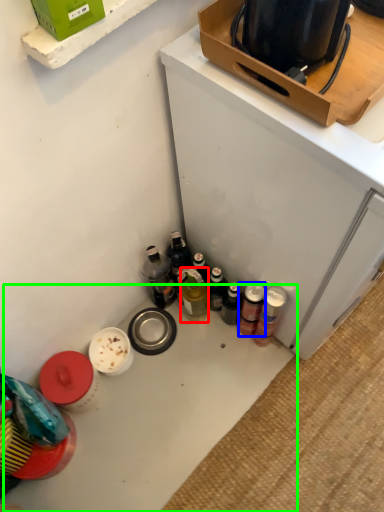
Question: Considering the real-world distances, which object is farthest from bottle (highlighted by a red box)? beverage (highlighted by a blue box) or table (highlighted by a green box)?

Choices:
 (A) beverage
 (B) table

Answer: (B)